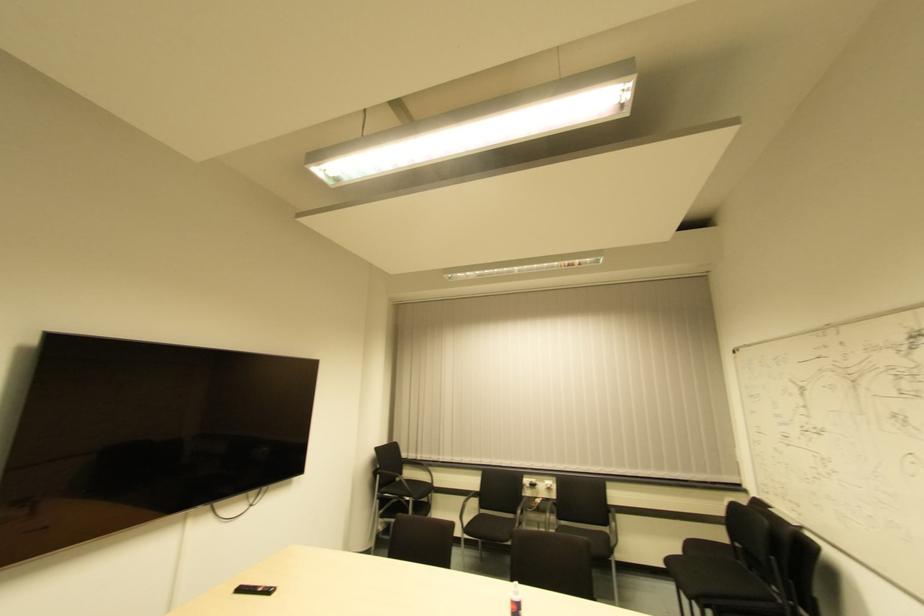
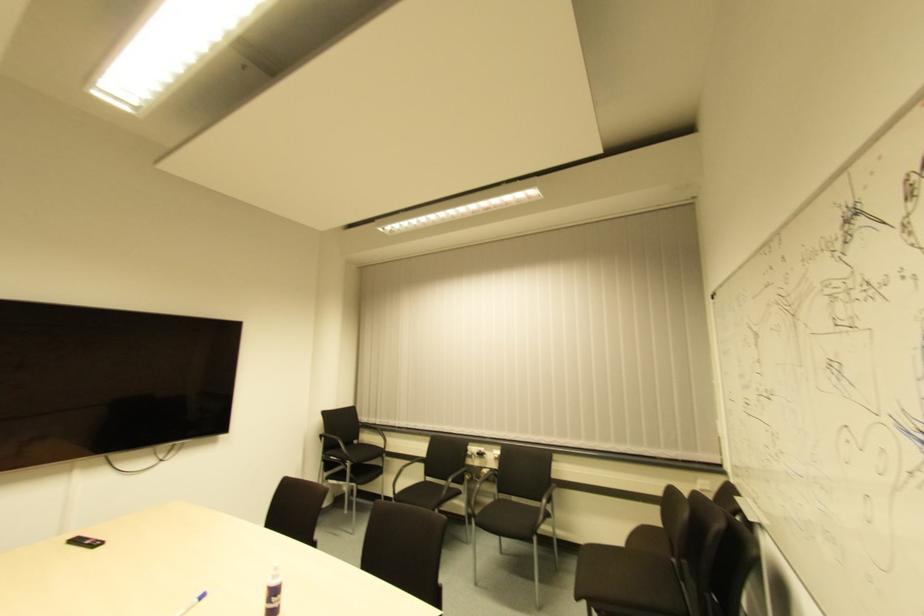
Where in the second image is the point corresponding to point (429, 485) from the first image?

(381, 448)